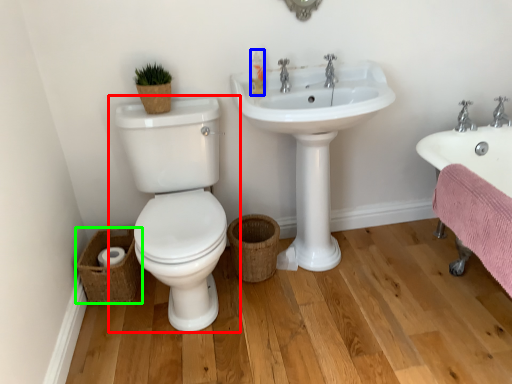
Question: Based on their relative distances, which object is nearer to toilet (highlighted by a red box)? Choose from toiletry (highlighted by a blue box) and basket (highlighted by a green box).

Choices:
 (A) toiletry
 (B) basket

Answer: (B)